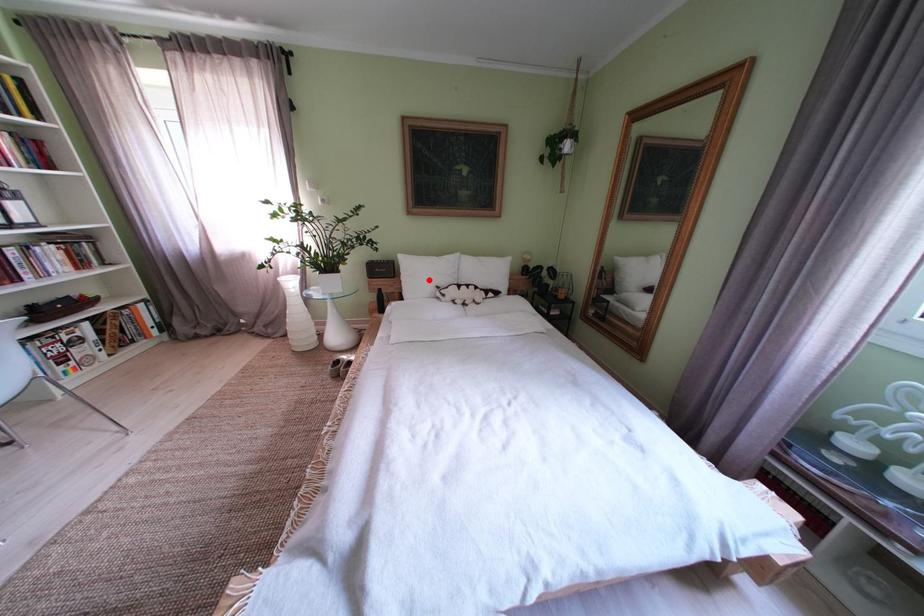
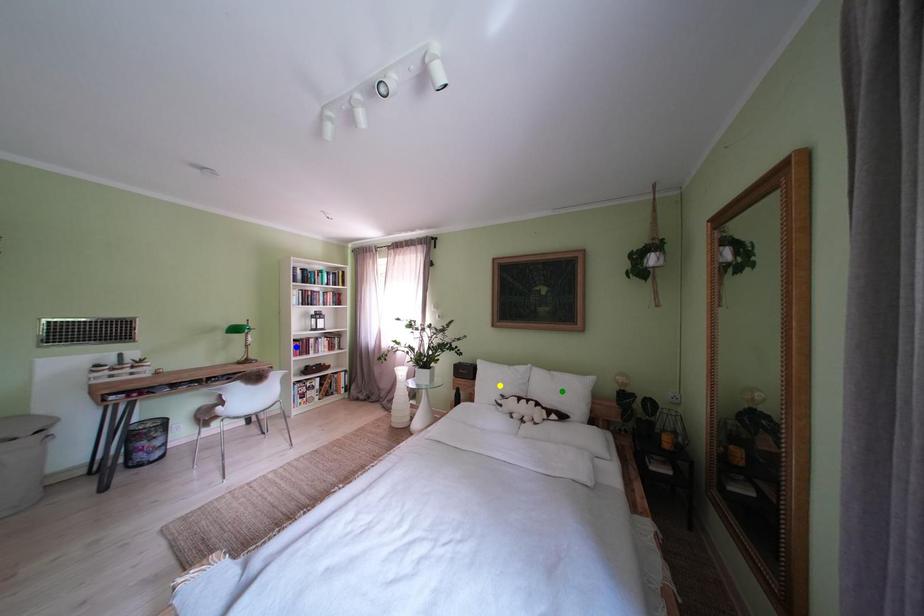
Question: I am providing you with two images of the same scene from different viewpoints. A red point is marked on the first image. You are given multiple points on the second image. Which spot in image 2 lines up with the point in image 1?

Choices:
 (A) yellow point
 (B) green point
 (C) blue point

Answer: (A)